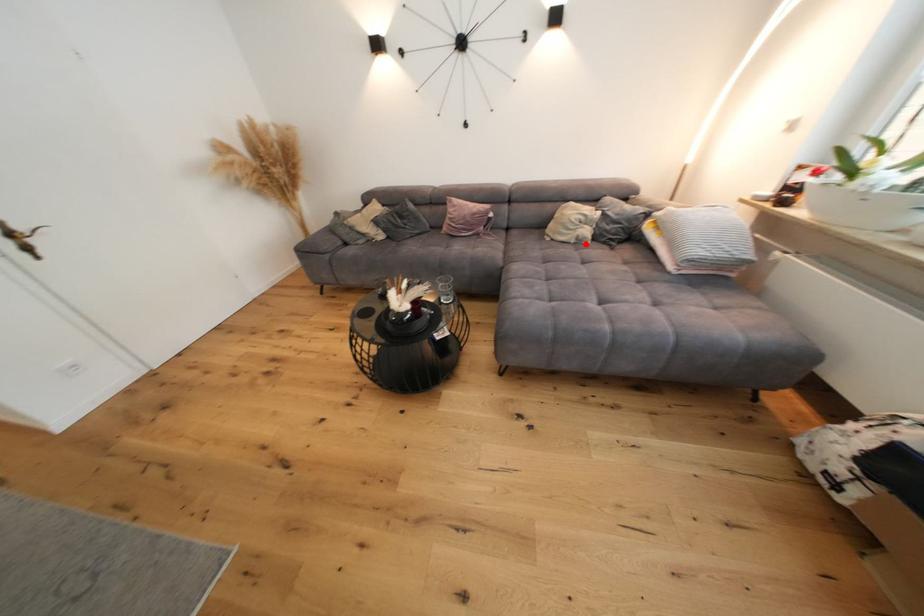
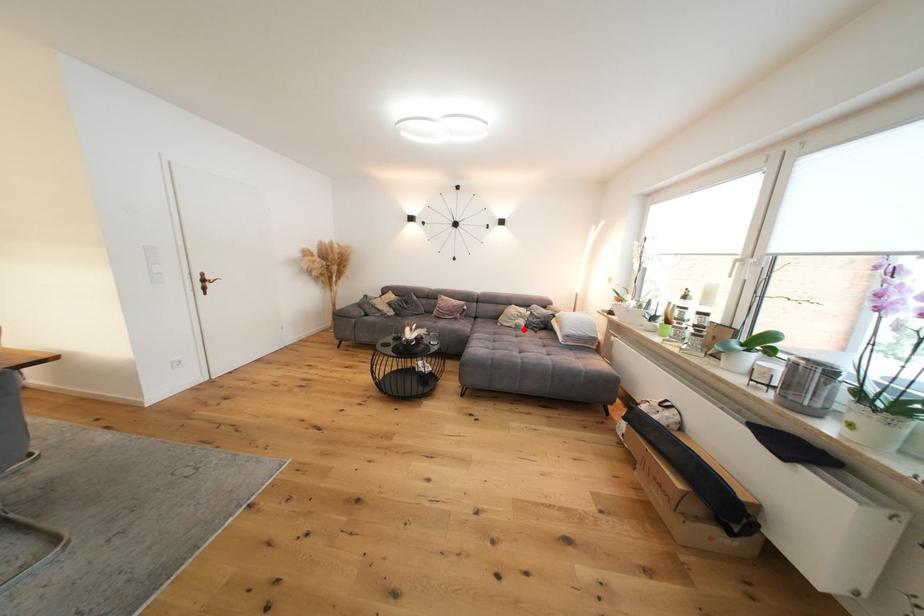
I am providing you with two images of the same scene from different viewpoints. A red point is marked on the first image and another point is marked on the second image. Are the points marked in image1 and image2 representing the same 3D position?

Yes